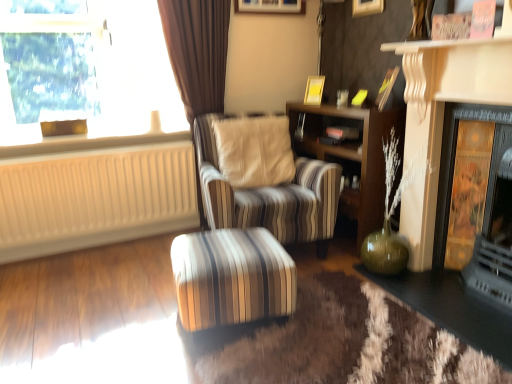
Question: From a real-world perspective, is wooden picture frame at upper center, which ranks as the 1th picture frame in left-to-right order, physically located above or below beige ribbed radiator at left?

Choices:
 (A) below
 (B) above

Answer: (B)

Question: Considering the positions of wooden picture frame at upper center, which is counted as the 2th picture frame, starting from the bottom, and beige ribbed radiator at left in the image, is wooden picture frame at upper center, which is counted as the 2th picture frame, starting from the bottom, taller or shorter than beige ribbed radiator at left?

Choices:
 (A) short
 (B) tall

Answer: (A)

Question: Which is nearer to the transparent glass window at upper left?

Choices:
 (A) striped fabric ottoman at center, which is the 1th table in left-to-right order
 (B) matte gold picture frame at upper center, the 3th picture frame viewed from the left
 (C) wooden picture frame at upper center, acting as the second picture frame starting from the top
 (D) beige ribbed radiator at left
 (E) wooden bookshelf at center

Answer: (D)

Question: Considering the real-world distances, which object is closest to the transparent glass window at upper left?

Choices:
 (A) gold textured panel at right
 (B) wooden picture frame at upper center, marked as the 3th picture frame in a right-to-left arrangement
 (C) wooden bookshelf at center
 (D) matte gold picture frame at upper center, the 3th picture frame viewed from the left
 (E) matte yellow picture frame at upper center, which appears as the second picture frame when viewed from the left

Answer: (B)